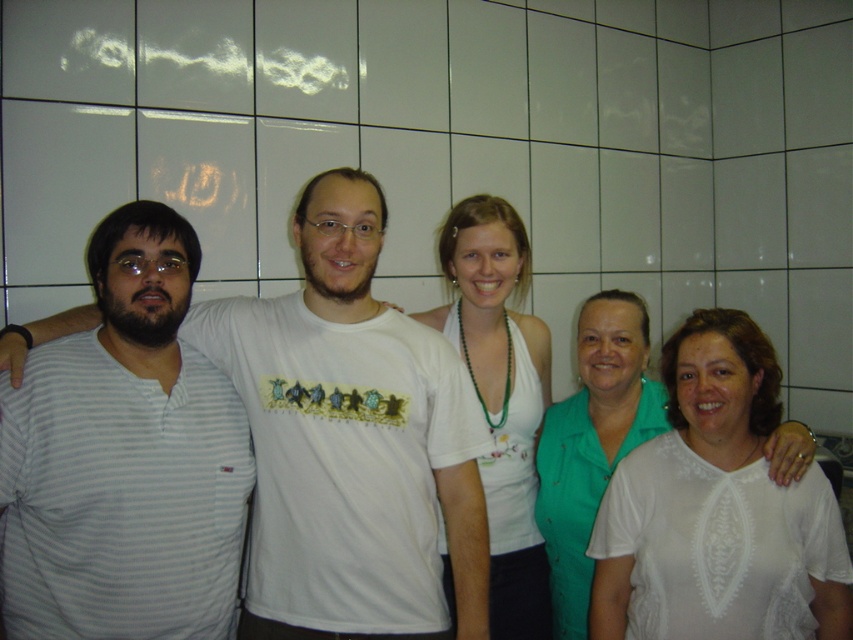
Question: Can you confirm if striped cotton shirt at left is positioned to the right of white lace blouse at center?

Choices:
 (A) no
 (B) yes

Answer: (A)

Question: Is white lace blouse at center below gray striped shirt at left?

Choices:
 (A) no
 (B) yes

Answer: (B)

Question: Does white fabric top at center have a smaller size compared to white lace blouse at center?

Choices:
 (A) no
 (B) yes

Answer: (A)

Question: Which of the following is the farthest from the observer?

Choices:
 (A) striped cotton shirt at left
 (B) gray striped shirt at left
 (C) white lace blouse at center
 (D) white fabric top at center

Answer: (C)

Question: Among these points, which one is nearest to the camera?

Choices:
 (A) (498, 346)
 (B) (610, 461)

Answer: (B)

Question: Which of the following is the farthest from the observer?

Choices:
 (A) white fabric top at center
 (B) gray striped shirt at left
 (C) striped cotton shirt at left
 (D) white lace blouse at center

Answer: (D)